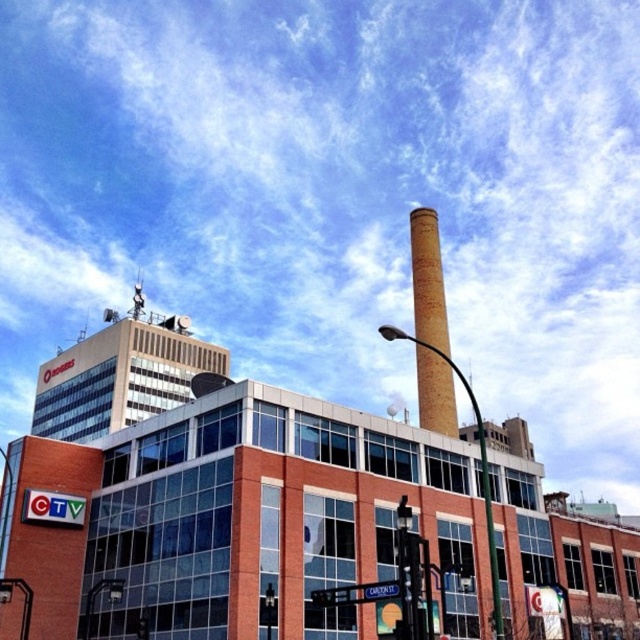
You are standing in front of the CTV building and notice a brick chimney at center and a brick pole at center. Which object is closer to you?

The brick chimney at center is closer to you because it is further to the viewer than the brick pole at center.

You are a city planner assessing the space between two structures in the urban scene. The brick chimney at center and the brick pole at center are both in the foreground. Which of these two objects has a narrower width?

The brick chimney at center has a narrower width than the brick pole at center according to the description.